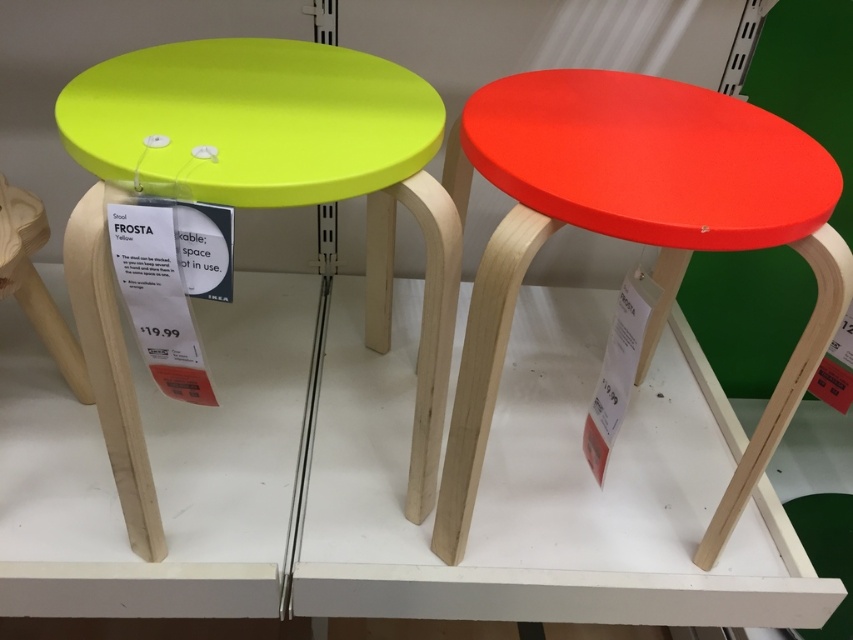
Question: Does matte yellow stool at left have a greater width compared to matte red stool at right?

Choices:
 (A) yes
 (B) no

Answer: (B)

Question: Among these objects, which one is farthest from the camera?

Choices:
 (A) matte yellow stool at left
 (B) matte red stool at right

Answer: (B)

Question: Is matte yellow stool at left in front of matte red stool at right?

Choices:
 (A) yes
 (B) no

Answer: (A)

Question: Which of the following is the farthest from the observer?

Choices:
 (A) matte red stool at right
 (B) matte yellow stool at left

Answer: (A)

Question: Which point is closer to the camera?

Choices:
 (A) (463, 456)
 (B) (381, 157)

Answer: (B)

Question: Is matte yellow stool at left below matte red stool at right?

Choices:
 (A) no
 (B) yes

Answer: (B)